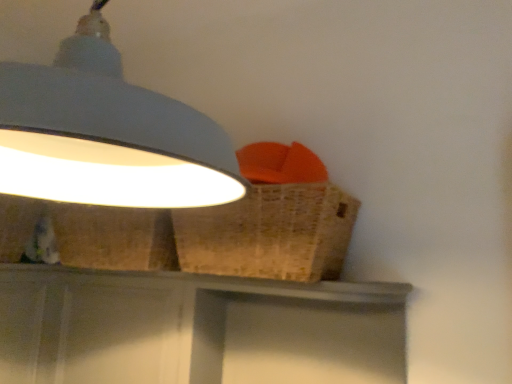
Question: Is woven brown basket at upper right bigger than matte gray vanity at center?

Choices:
 (A) yes
 (B) no

Answer: (B)

Question: From the image's perspective, is woven brown basket at upper right beneath matte gray vanity at center?

Choices:
 (A) yes
 (B) no

Answer: (B)

Question: Can you confirm if woven brown basket at upper right is taller than matte gray vanity at center?

Choices:
 (A) no
 (B) yes

Answer: (A)

Question: From a real-world perspective, is woven brown basket at upper right located beneath matte gray vanity at center?

Choices:
 (A) no
 (B) yes

Answer: (A)

Question: Can you confirm if woven brown basket at upper right is thinner than matte gray vanity at center?

Choices:
 (A) no
 (B) yes

Answer: (A)

Question: Are woven brown basket at upper right and matte gray vanity at center making contact?

Choices:
 (A) no
 (B) yes

Answer: (A)

Question: Can you confirm if matte gray vanity at center is thinner than woven brown basket at upper right?

Choices:
 (A) no
 (B) yes

Answer: (B)

Question: Does matte gray vanity at center come behind woven brown basket at upper right?

Choices:
 (A) yes
 (B) no

Answer: (A)

Question: From the image's perspective, is matte gray vanity at center beneath woven brown basket at upper right?

Choices:
 (A) no
 (B) yes

Answer: (B)

Question: From a real-world perspective, is matte gray vanity at center under woven brown basket at upper right?

Choices:
 (A) no
 (B) yes

Answer: (B)

Question: Does matte gray vanity at center have a greater height compared to woven brown basket at upper right?

Choices:
 (A) yes
 (B) no

Answer: (A)

Question: Does matte gray vanity at center touch woven brown basket at upper right?

Choices:
 (A) yes
 (B) no

Answer: (B)

Question: Can you confirm if white matte lampshade at upper left is thinner than woven brown basket at upper right?

Choices:
 (A) no
 (B) yes

Answer: (A)